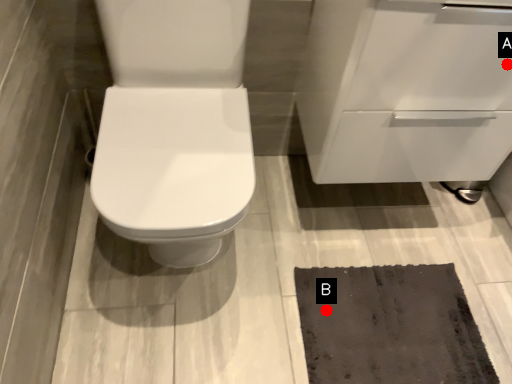
Question: Two points are circled on the image, labeled by A and B beside each circle. Among these points, which one is farthest from the camera?

Choices:
 (A) A is further
 (B) B is further

Answer: (B)